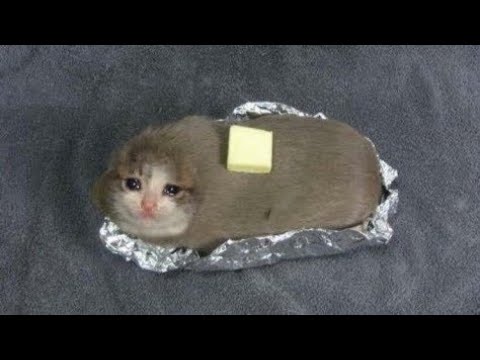
Identify the location of carpet. (384, 111).